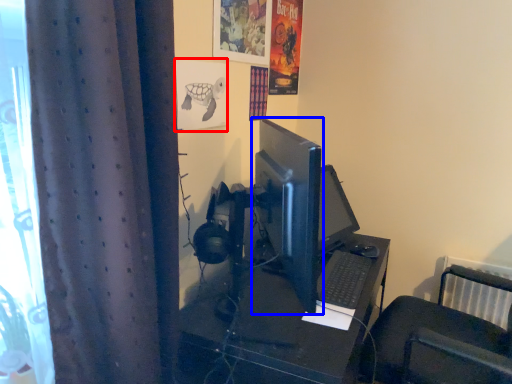
Question: Which object is further to the camera taking this photo, poster page (highlighted by a red box) or computer monitor (highlighted by a blue box)?

Choices:
 (A) poster page
 (B) computer monitor

Answer: (B)